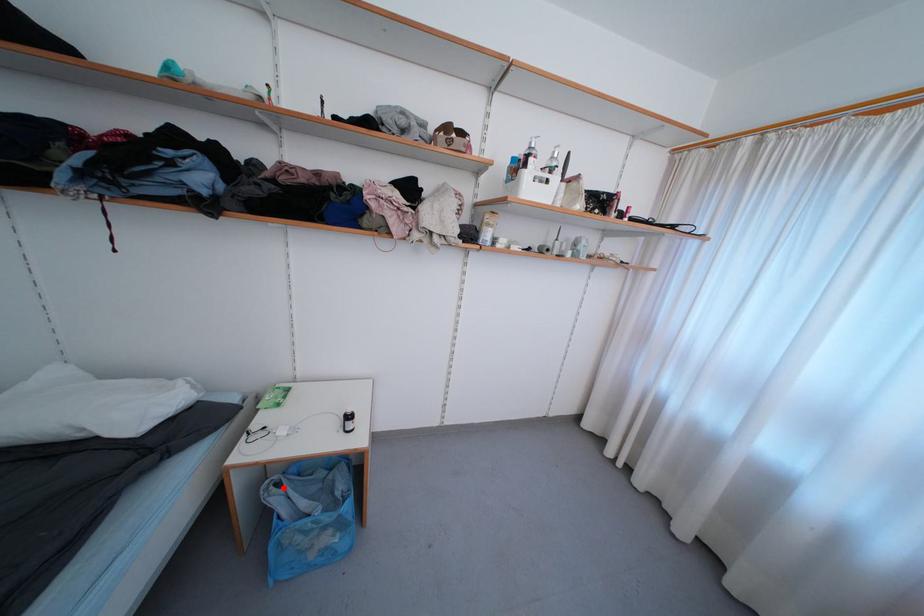
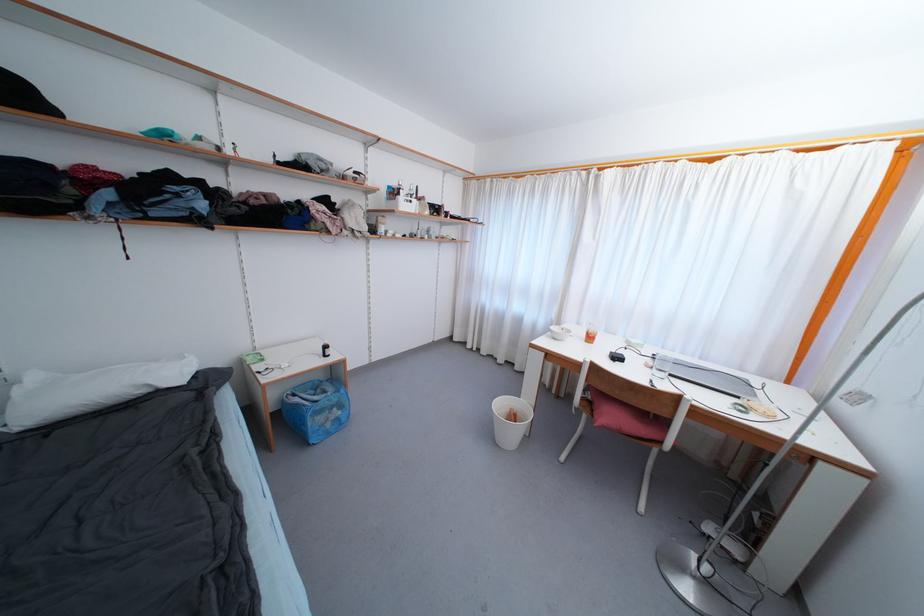
Locate, in the second image, the point that corresponds to the highlighted location in the first image.

(298, 398)